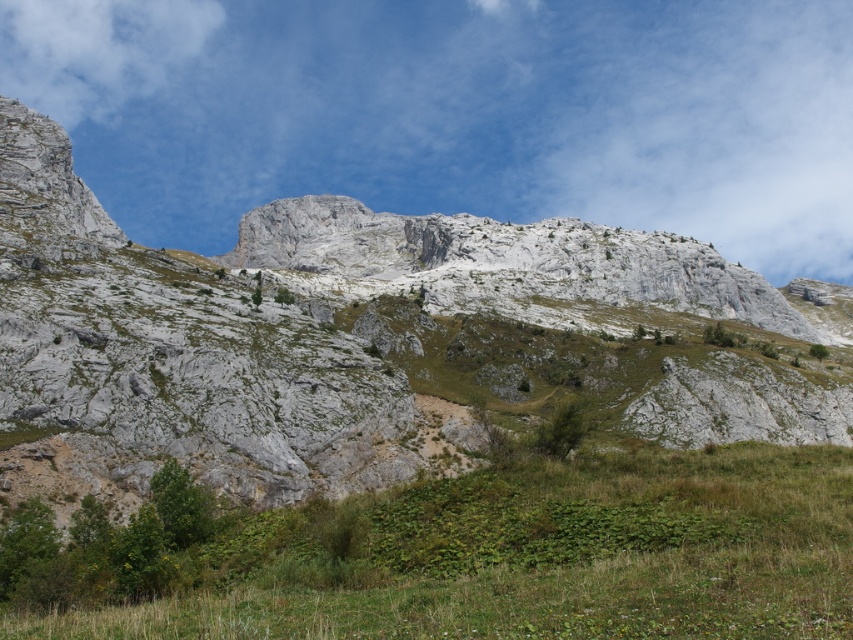
Looking at this image, can you confirm if gray rock mountain at center is bigger than green grassy at lower center?

Yes, gray rock mountain at center is bigger than green grassy at lower center.

Which is behind, point (225, 339) or point (743, 582)?

The point (225, 339) is behind.

You are a GUI agent. You are given a task and a screenshot of the screen. Output one action in this format:
    pyautogui.click(x=<x>, y=<y>)
    Task: Click on the gray rock mountain at center
    
    Given the screenshot: What is the action you would take?
    pyautogui.click(x=370, y=340)